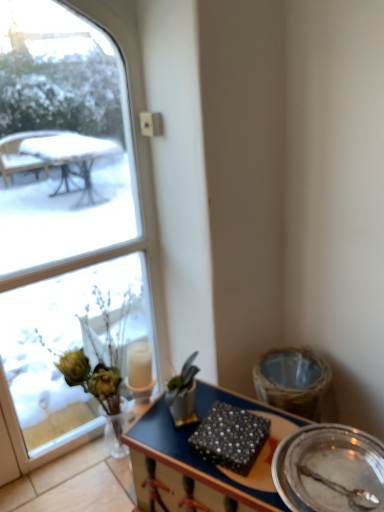
Find the location of a particular element. This screenshot has height=512, width=384. vacant space situated above pearl-patterned fabric at center (from a real-world perspective) is located at coordinates (237, 423).